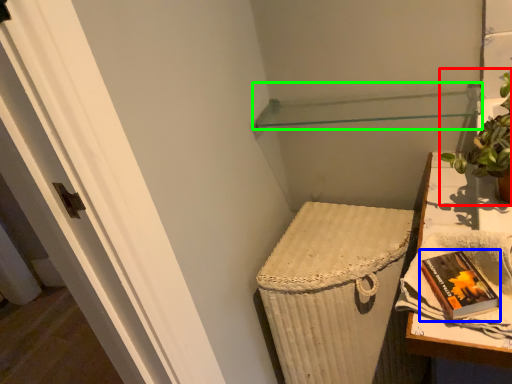
Question: Which object is positioned farthest from houseplant (highlighted by a red box)? Select from paperback book (highlighted by a blue box) and shelf (highlighted by a green box).

Choices:
 (A) paperback book
 (B) shelf

Answer: (B)